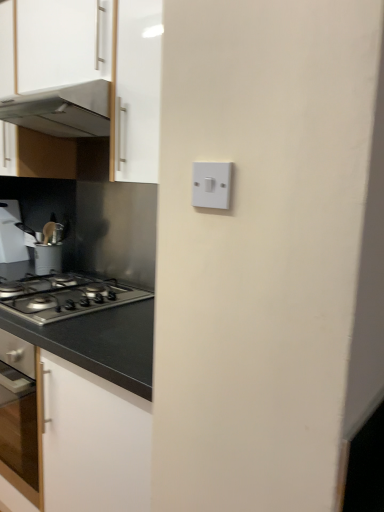
Question: Can you confirm if metallic stainless steel range hood at upper left is bigger than white plastic light switch at center?

Choices:
 (A) yes
 (B) no

Answer: (A)

Question: From the image's perspective, is metallic stainless steel range hood at upper left located beneath white plastic light switch at center?

Choices:
 (A) no
 (B) yes

Answer: (A)

Question: Is metallic stainless steel range hood at upper left positioned before white plastic light switch at center?

Choices:
 (A) yes
 (B) no

Answer: (B)

Question: Can you confirm if metallic stainless steel range hood at upper left is shorter than white plastic light switch at center?

Choices:
 (A) yes
 (B) no

Answer: (B)

Question: From a real-world perspective, is metallic stainless steel range hood at upper left under white plastic light switch at center?

Choices:
 (A) no
 (B) yes

Answer: (A)

Question: From the image's perspective, relative to white glossy cabinet at upper left, is metallic stainless steel range hood at upper left above or below?

Choices:
 (A) above
 (B) below

Answer: (B)

Question: Looking at their shapes, would you say metallic stainless steel range hood at upper left is wider or thinner than white glossy cabinet at upper left?

Choices:
 (A) wide
 (B) thin

Answer: (A)

Question: Is metallic stainless steel range hood at upper left spatially inside white glossy cabinet at upper left, or outside of it?

Choices:
 (A) outside
 (B) inside

Answer: (B)

Question: In the image, is metallic stainless steel range hood at upper left on the left side or the right side of white glossy cabinet at upper left?

Choices:
 (A) left
 (B) right

Answer: (B)

Question: Considering their positions, is brushed metal utensil holder at left located in front of or behind white glossy cabinet at upper left?

Choices:
 (A) behind
 (B) front

Answer: (A)

Question: From the image's perspective, is brushed metal utensil holder at left positioned above or below white glossy cabinet at upper left?

Choices:
 (A) below
 (B) above

Answer: (A)

Question: Considering the relative positions of brushed metal utensil holder at left and white glossy cabinet at upper left in the image provided, is brushed metal utensil holder at left to the left or to the right of white glossy cabinet at upper left?

Choices:
 (A) right
 (B) left

Answer: (B)

Question: In terms of size, does brushed metal utensil holder at left appear bigger or smaller than white glossy cabinet at upper left?

Choices:
 (A) small
 (B) big

Answer: (A)

Question: Does point (228, 187) appear closer or farther from the camera than point (18, 117)?

Choices:
 (A) farther
 (B) closer

Answer: (B)

Question: From a real-world perspective, is white plastic light switch at center above or below white glossy cabinet at upper left?

Choices:
 (A) above
 (B) below

Answer: (B)